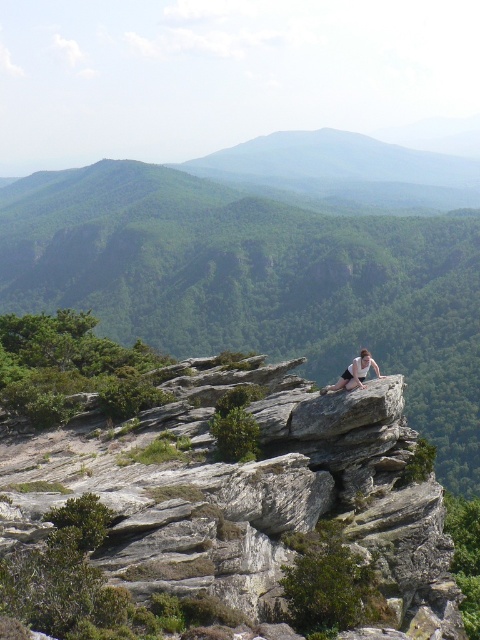
Question: Among these points, which one is farthest from the camera?

Choices:
 (A) (203, 554)
 (B) (345, 371)
 (C) (285, 138)

Answer: (C)

Question: Considering the relative positions of gray rough rock at center and green matte mountain at center in the image provided, where is gray rough rock at center located with respect to green matte mountain at center?

Choices:
 (A) below
 (B) above

Answer: (A)

Question: Estimate the real-world distances between objects in this image. Which object is closer to the light brown skin at center?

Choices:
 (A) green matte mountain at center
 (B) gray rough rock at center

Answer: (B)

Question: Is gray rough rock at center bigger than green matte mountain at center?

Choices:
 (A) yes
 (B) no

Answer: (B)

Question: Which of the following is the closest to the observer?

Choices:
 (A) (452, 164)
 (B) (363, 378)

Answer: (B)

Question: Is gray rough rock at center bigger than light brown skin at center?

Choices:
 (A) no
 (B) yes

Answer: (B)